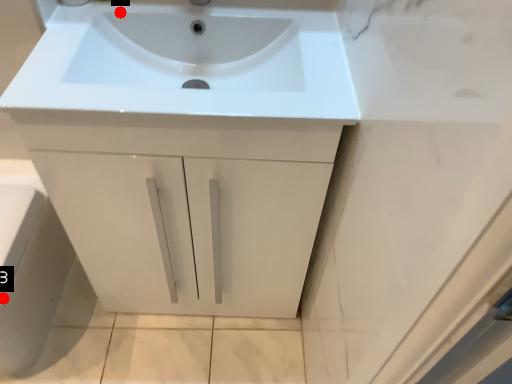
Question: Two points are circled on the image, labeled by A and B beside each circle. Which point is farther from the camera taking this photo?

Choices:
 (A) A is further
 (B) B is further

Answer: (A)